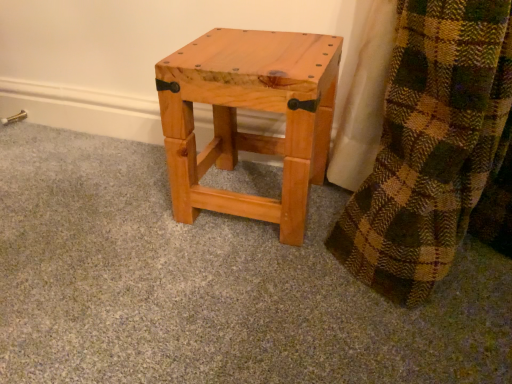
What do you see at coordinates (252, 109) in the screenshot? The height and width of the screenshot is (384, 512). I see `natural wood stool at center` at bounding box center [252, 109].

Find the location of a particular element. The width and height of the screenshot is (512, 384). natural wood stool at center is located at coordinates (252, 109).

You are a GUI agent. You are given a task and a screenshot of the screen. Output one action in this format:
    pyautogui.click(x=<x>, y=<y>)
    Task: Click on the natural wood stool at center
    This screenshot has height=384, width=512.
    Given the screenshot: What is the action you would take?
    pyautogui.click(x=252, y=109)